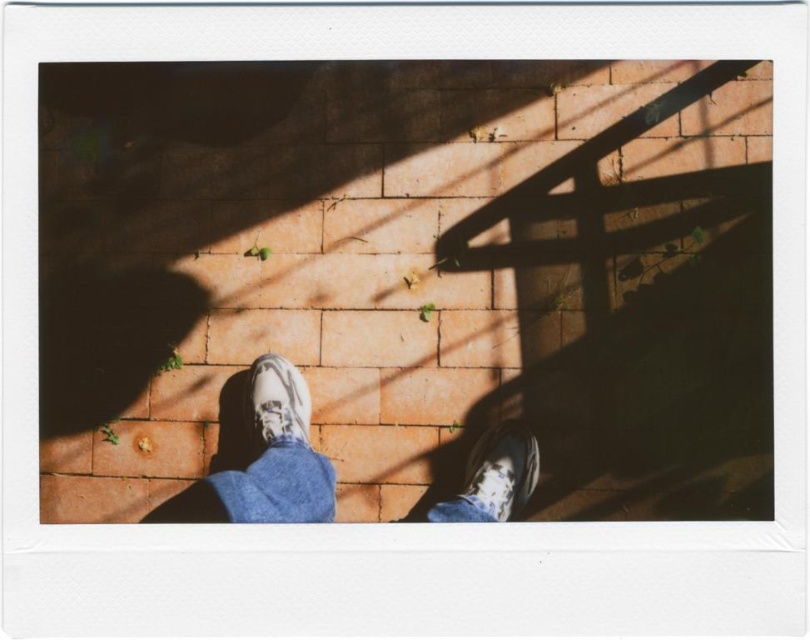
From the picture: Who is more forward, (250, 522) or (254, 413)?

Point (250, 522) is in front.

Which is more to the left, leather sneakers at center or white textured shoe at center?

leather sneakers at center is more to the left.

Does point (259, 481) lie behind point (288, 387)?

No, it is in front of (288, 387).

Find the location of `leather sneakers at center`. leather sneakers at center is located at coordinates (265, 461).

Between point (487, 474) and point (249, 433), which one is positioned behind?

The point (249, 433) is behind.

Is point (495, 461) more distant than point (278, 422)?

Yes, point (495, 461) is farther from viewer.

The image size is (810, 640). I want to click on white matte shoe at lower center, so click(x=501, y=470).

Is leather sneakers at center smaller than white matte shoe at lower center?

Incorrect, leather sneakers at center is not smaller in size than white matte shoe at lower center.

Where is `leather sneakers at center`? leather sneakers at center is located at coordinates click(x=265, y=461).

Where is `leather sneakers at center`? Image resolution: width=810 pixels, height=640 pixels. leather sneakers at center is located at coordinates (265, 461).